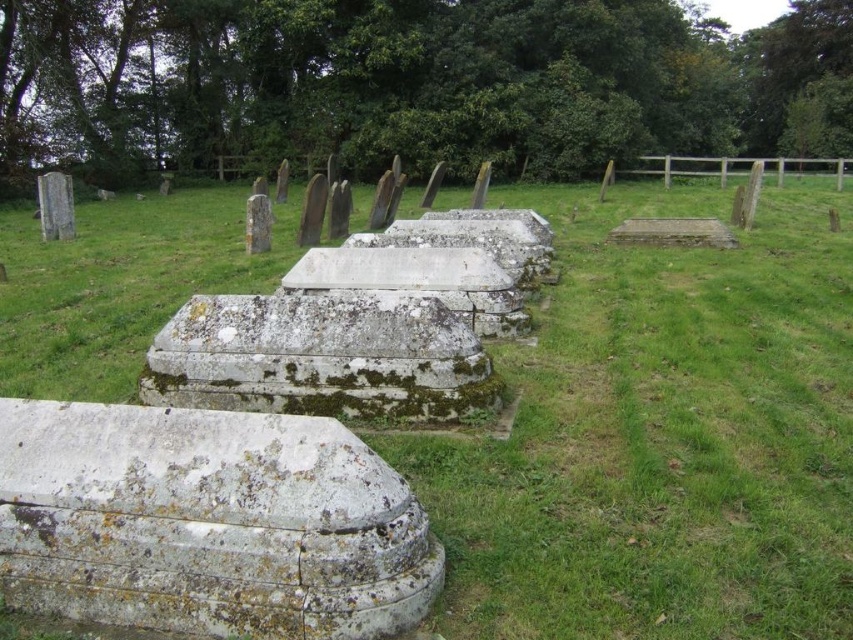
You are standing at the entrance of the cemetery and want to reach the point marked as point [79,538] and point [202,384]. Which point should you head towards first if you want to reach the one closer to you?

You should head towards point [79,538] first because it is closer to you than point [202,384].